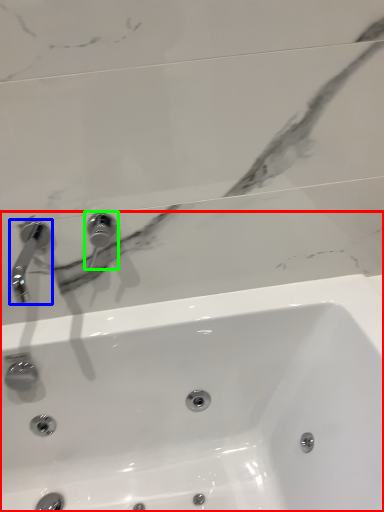
Question: Which object is positioned closest to sink (highlighted by a red box)? Select from tap (highlighted by a blue box) and tap (highlighted by a green box).

Choices:
 (A) tap
 (B) tap

Answer: (B)